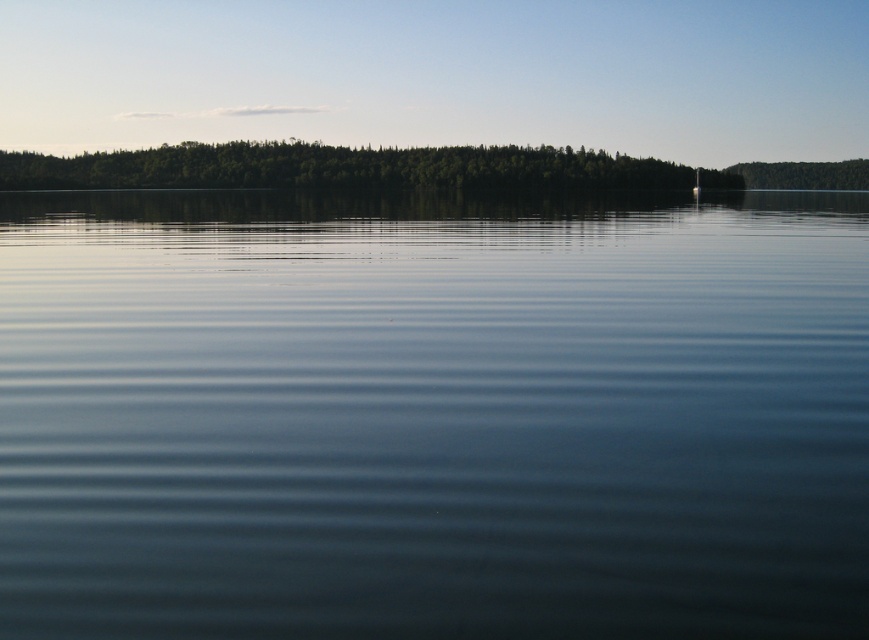
You are standing at the edge of the lake and notice a point marked at coordinates [432,413]. Based on the scene description, what is the nature of the surface at this point?

The point at [432,413] corresponds to transparent water at center, so the surface there is calm and reflective, as described in the scene.

You are standing on a dock overlooking the lake and see the transparent water at center and the green leafy trees at upper center. Which object appears smaller in the image?

The transparent water at center appears smaller than the green leafy trees at upper center.

You are standing at the edge of the lake and notice two points in the scene. The first point is labeled as point (244, 365) and the second is point (203, 164). Which of these two points is nearer to your current position?

Point (244, 365) is closer to the camera than point (203, 164), so the first point is nearer to your current position.